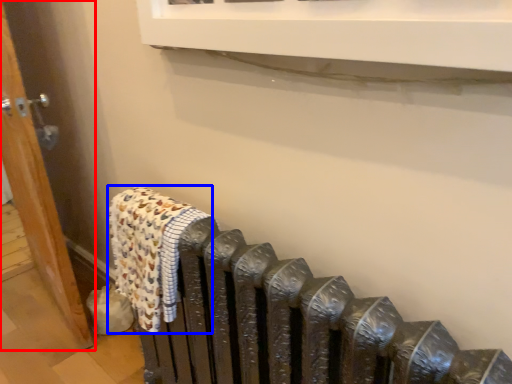
Question: Which of the following is the farthest to the observer, door (highlighted by a red box) or bath towel (highlighted by a blue box)?

Choices:
 (A) door
 (B) bath towel

Answer: (A)